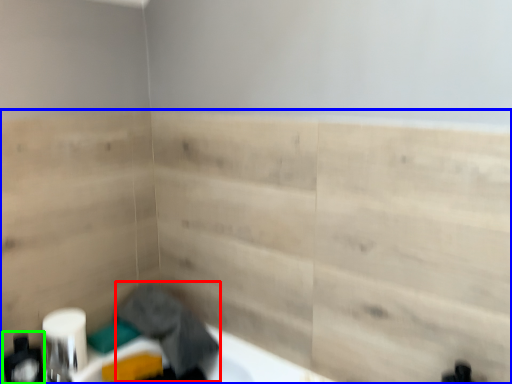
Question: Based on their relative distances, which object is farther from laundry (highlighted by a red box)? Choose from plywood (highlighted by a blue box) and toiletry (highlighted by a green box).

Choices:
 (A) plywood
 (B) toiletry

Answer: (B)